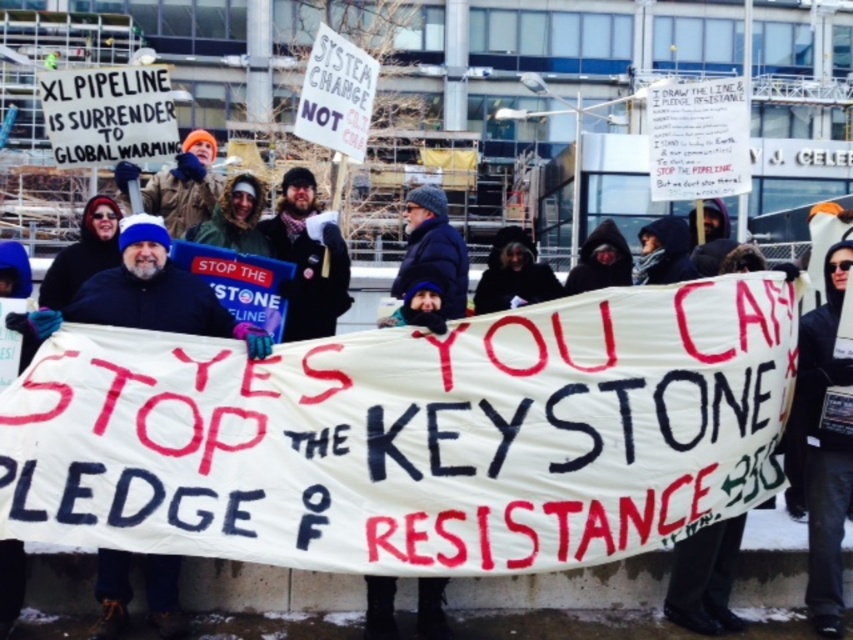
You are a photographer trying to capture the central banner and the bearded man in the same frame. Given that your camera has a focal length of 50mm and the minimum distance between objects to be in focus is 6 feet, can you include both the white fabric banner at center and the bearded man with scarf at center in a single focused shot?

The distance between the white fabric banner at center and the bearded man with scarf at center is 7.55 feet. Since the minimum distance your camera can focus on objects is 6 feet, you can capture both in a single focused shot as 7.55 feet exceeds the 6 feet requirement.